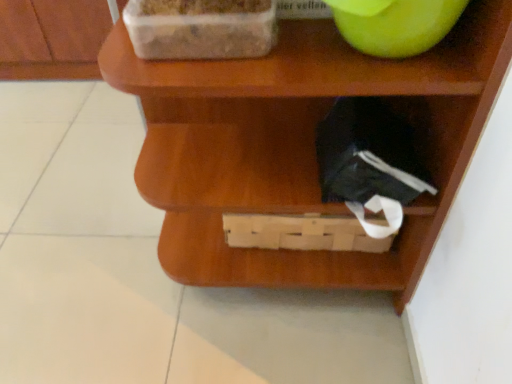
Question: From the image's perspective, is transparent plastic container at upper left positioned above or below wooden basket at lower center?

Choices:
 (A) above
 (B) below

Answer: (A)

Question: Is transparent plastic container at upper left in front of or behind wooden basket at lower center in the image?

Choices:
 (A) front
 (B) behind

Answer: (B)

Question: Estimate the real-world distances between objects in this image. Which object is farther from the green matte apple at upper right?

Choices:
 (A) wooden basket at lower center
 (B) transparent plastic container at upper left

Answer: (A)

Question: Considering the real-world distances, which object is farthest from the transparent plastic container at upper left?

Choices:
 (A) wooden basket at lower center
 (B) green matte apple at upper right

Answer: (A)